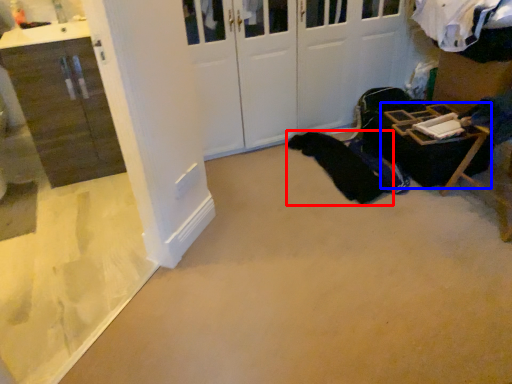
Question: Which of the following is the farthest to the observer, clothing (highlighted by a red box) or furniture (highlighted by a blue box)?

Choices:
 (A) clothing
 (B) furniture

Answer: (A)